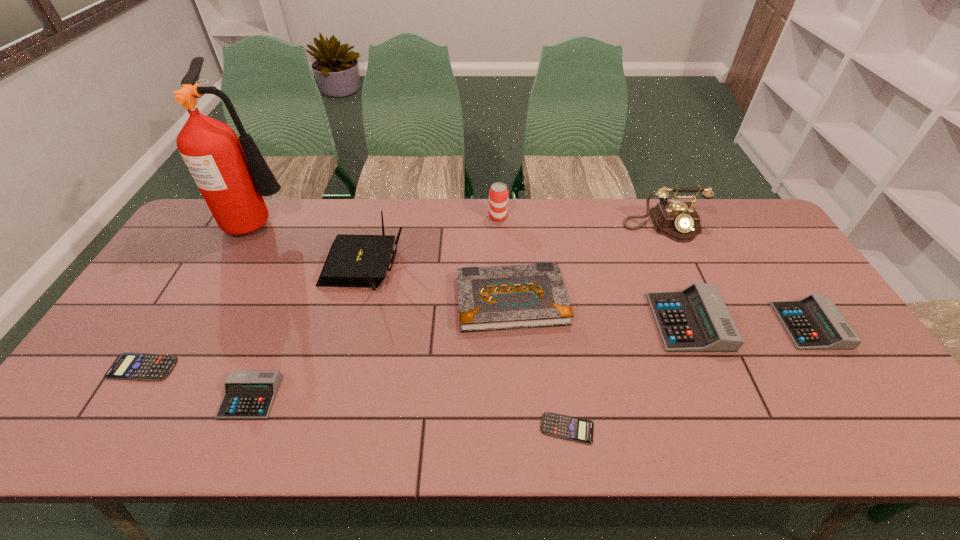
This screenshot has width=960, height=540. What are the coordinates of `fire extinguisher` in the screenshot? It's located at (232, 175).

Where is `the tallest object`? Image resolution: width=960 pixels, height=540 pixels. the tallest object is located at coordinates (232, 175).

Identify the location of black telephone. The height and width of the screenshot is (540, 960). (679, 221).

This screenshot has height=540, width=960. Identify the location of the second tallest object. [x=679, y=221].

The height and width of the screenshot is (540, 960). Find the location of `orange beer can`. orange beer can is located at coordinates (498, 194).

Find the location of `the fourth object from left to right`. the fourth object from left to right is located at coordinates (353, 260).

Identify the location of router. Image resolution: width=960 pixels, height=540 pixels. (353, 260).

The height and width of the screenshot is (540, 960). What are the coordinates of `the fourth calculator from left to right` in the screenshot? It's located at (696, 319).

Locate an element on the screen. The image size is (960, 540). the second gray calculator from left to right is located at coordinates (696, 319).

This screenshot has height=540, width=960. Identify the location of notebook. (492, 298).